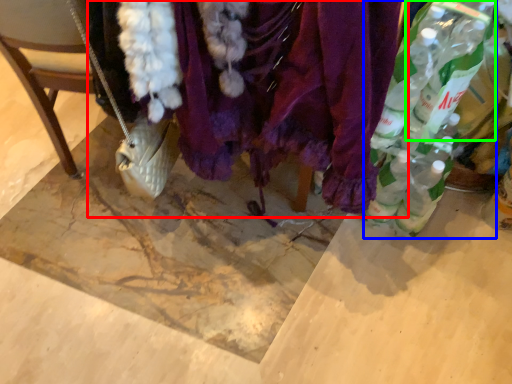
Question: Which object is the closest to the textile (highlighted by a red box)? Choose among these: bottle (highlighted by a blue box) or bottle (highlighted by a green box).

Choices:
 (A) bottle
 (B) bottle

Answer: (A)